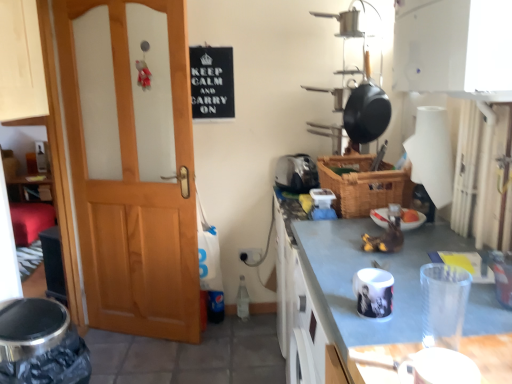
Question: Is white glossy cabinet at upper center facing away from wooden door at left?

Choices:
 (A) no
 (B) yes

Answer: (A)

Question: Can we say white glossy cabinet at upper center lies outside wooden door at left?

Choices:
 (A) yes
 (B) no

Answer: (A)

Question: From a real-world perspective, does white glossy cabinet at upper center sit lower than wooden door at left?

Choices:
 (A) yes
 (B) no

Answer: (A)

Question: Does white glossy cabinet at upper center appear on the left side of wooden door at left?

Choices:
 (A) no
 (B) yes

Answer: (A)

Question: Is white glossy cabinet at upper center aimed at wooden door at left?

Choices:
 (A) yes
 (B) no

Answer: (B)

Question: Would you consider white glossy cabinet at upper center to be distant from wooden door at left?

Choices:
 (A) no
 (B) yes

Answer: (B)

Question: Could you tell me if white glossy cabinet at upper center is facing white glossy mug at center, which is counted as the fourth appliance, starting from the top?

Choices:
 (A) no
 (B) yes

Answer: (A)

Question: Considering the relative sizes of white glossy cabinet at upper center and white glossy mug at center, the second appliance positioned from the front, in the image provided, is white glossy cabinet at upper center thinner than white glossy mug at center, the second appliance positioned from the front,?

Choices:
 (A) no
 (B) yes

Answer: (A)

Question: From a real-world perspective, is white glossy cabinet at upper center positioned over white glossy mug at center, the second appliance positioned from the front, based on gravity?

Choices:
 (A) no
 (B) yes

Answer: (A)

Question: Does white glossy cabinet at upper center contain white glossy mug at center, placed as the 1th appliance when sorted from bottom to top?

Choices:
 (A) no
 (B) yes

Answer: (A)

Question: Can you confirm if white glossy cabinet at upper center is positioned to the left of white glossy mug at center, the second appliance positioned from the front?

Choices:
 (A) no
 (B) yes

Answer: (A)

Question: Is white glossy cabinet at upper center not within white glossy mug at center, the second appliance positioned from the front?

Choices:
 (A) yes
 (B) no

Answer: (A)

Question: Considering the relative sizes of white glossy mug at center, positioned as the third appliance in back-to-front order, and black matte sign at upper center in the image provided, is white glossy mug at center, positioned as the third appliance in back-to-front order, bigger than black matte sign at upper center?

Choices:
 (A) no
 (B) yes

Answer: (A)